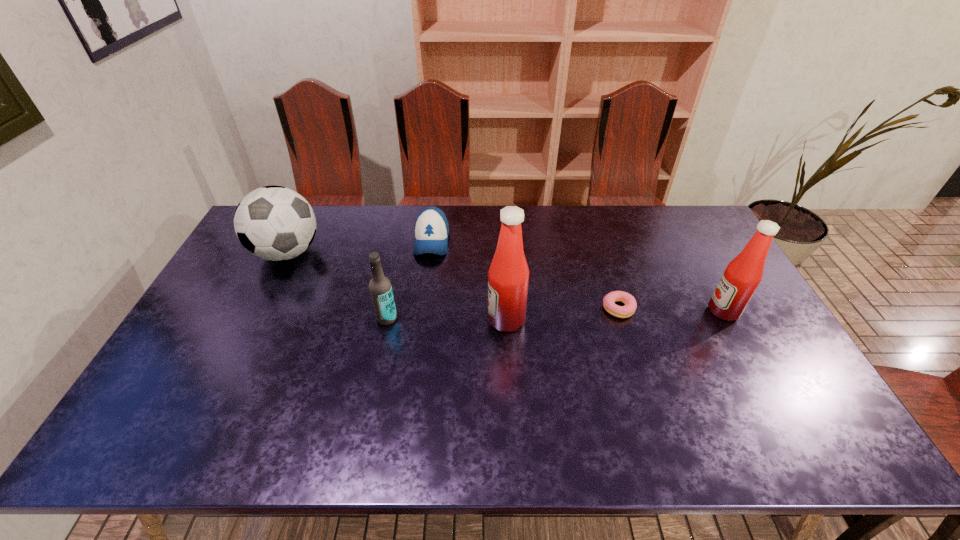
Identify the location of vacant space that's between the fifth object from left to right and the soccer ball. (453, 280).

Find the location of `free area in between the tallest object and the third object from left to right`. free area in between the tallest object and the third object from left to right is located at coordinates (468, 280).

Where is `vacant area that lies between the second object from right to left and the rightmost object`? This screenshot has width=960, height=540. vacant area that lies between the second object from right to left and the rightmost object is located at coordinates [671, 309].

Where is `vacant space that's between the second object from left to right and the fifth tallest object`? vacant space that's between the second object from left to right and the fifth tallest object is located at coordinates (409, 280).

You are a GUI agent. You are given a task and a screenshot of the screen. Output one action in this format:
    pyautogui.click(x=<x>, y=<y>)
    Task: Click on the free spot between the third object from left to right and the tallest object
    The height and width of the screenshot is (540, 960).
    Given the screenshot: What is the action you would take?
    pyautogui.click(x=468, y=280)

This screenshot has width=960, height=540. In order to click on free space between the tallest object and the second shortest object in this screenshot , I will do `click(468, 280)`.

Where is `object that stands as the fifth closest to the fifth object from right to left`? The image size is (960, 540). object that stands as the fifth closest to the fifth object from right to left is located at coordinates (742, 276).

Locate which object is the fourth closest to the rightmost object. Please provide its 2D coordinates. Your answer should be formatted as a tuple, i.e. [(x, y)], where the tuple contains the x and y coordinates of a point satisfying the conditions above.

[(380, 287)]

Where is `free spot that satisfies the following two spatial constraints: 1. on the front-facing side of the fifth shortest object; 2. on the side of the fifth object from right to left with the label`? Image resolution: width=960 pixels, height=540 pixels. free spot that satisfies the following two spatial constraints: 1. on the front-facing side of the fifth shortest object; 2. on the side of the fifth object from right to left with the label is located at coordinates (728, 318).

Image resolution: width=960 pixels, height=540 pixels. I want to click on vacant space that satisfies the following two spatial constraints: 1. on the front-facing side of the rightmost object; 2. on the side of the fifth object from right to left with the label, so click(x=728, y=318).